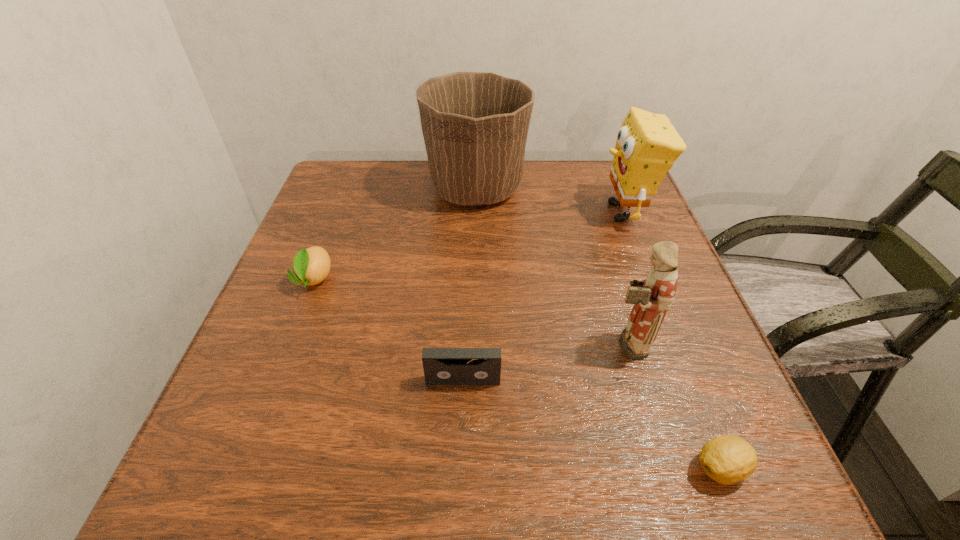
The width and height of the screenshot is (960, 540). In the image, there is a desktop. In order to click on vacant space at the right edge in this screenshot , I will do `click(695, 313)`.

Identify the location of vacant space at the near left corner of the desktop. This screenshot has height=540, width=960. (257, 466).

Where is `vacant position at the far right corner of the desktop`? vacant position at the far right corner of the desktop is located at coordinates (x=578, y=194).

Where is `free space between the figurine and the videotape`? free space between the figurine and the videotape is located at coordinates (544, 362).

Identify the location of vacant space in between the videotape and the sponge. (543, 296).

The image size is (960, 540). What are the coordinates of `free space between the sponge and the fourth farthest object` in the screenshot? It's located at (625, 278).

Find the location of `free space between the fourth farthest object and the left lemon`. free space between the fourth farthest object and the left lemon is located at coordinates (470, 312).

Image resolution: width=960 pixels, height=540 pixels. I want to click on free space that is in between the flowerpot and the figurine, so click(551, 266).

Locate an element on the screen. free space that is in between the right lemon and the fourth nearest object is located at coordinates (517, 374).

At what (x,y) coordinates should I click in order to perform the action: click on vacant space that's between the figurine and the videotape. Please return your answer as a coordinate pair (x, y). Image resolution: width=960 pixels, height=540 pixels. Looking at the image, I should click on (544, 362).